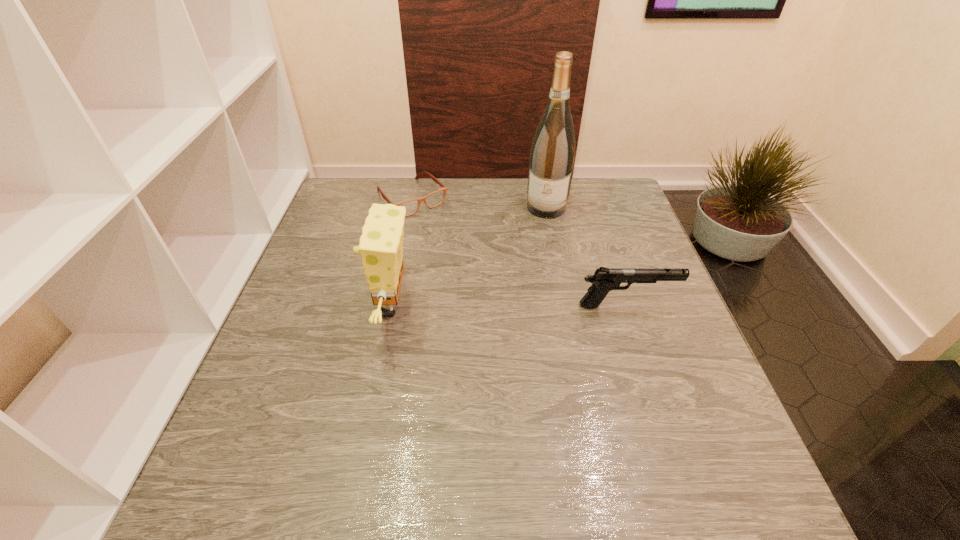
At what (x,y) coordinates should I click in order to perform the action: click on free space located on the front-facing side of the spectacles. Please return your answer as a coordinate pair (x, y). Looking at the image, I should click on (475, 265).

Locate an element on the screen. Image resolution: width=960 pixels, height=540 pixels. vacant space located 0.380m on the front-facing side of the spectacles is located at coordinates (505, 295).

At what (x,y) coordinates should I click in order to perform the action: click on vacant area situated on the front-facing side of the spectacles. Please return your answer as a coordinate pair (x, y). Looking at the image, I should click on (446, 234).

Locate an element on the screen. wine bottle present at the far edge is located at coordinates (552, 155).

Locate an element on the screen. The image size is (960, 540). spectacles at the far edge is located at coordinates (433, 199).

Find the location of a particular element. The image size is (960, 540). object at the left edge is located at coordinates (433, 199).

This screenshot has width=960, height=540. In order to click on object that is at the right edge in this screenshot , I will do `click(604, 280)`.

Where is `object that is at the far left corner`? object that is at the far left corner is located at coordinates (433, 199).

The image size is (960, 540). In the image, there is a desktop. In order to click on free space at the far edge in this screenshot , I will do `click(445, 197)`.

This screenshot has width=960, height=540. What are the coordinates of `vacant space at the near edge of the desktop` in the screenshot? It's located at (327, 445).